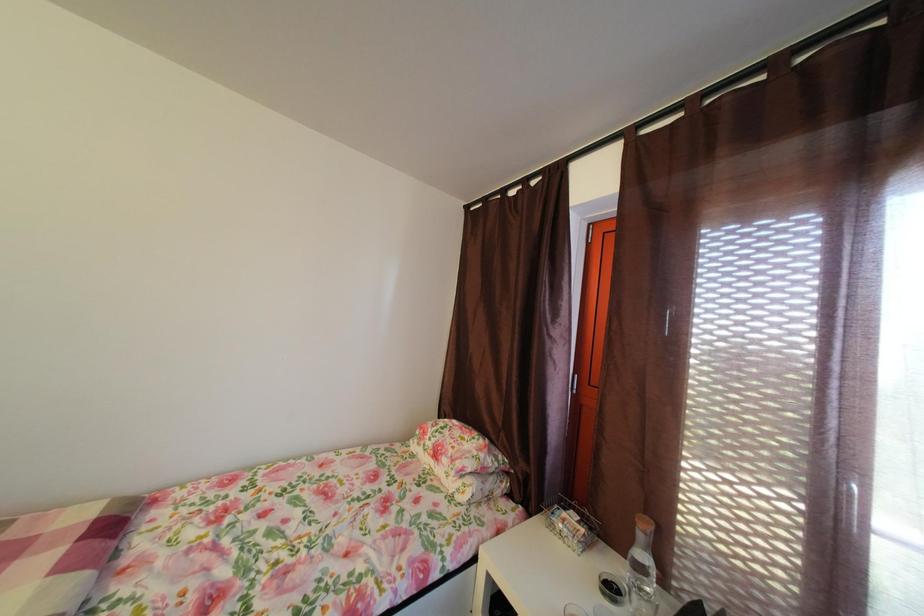
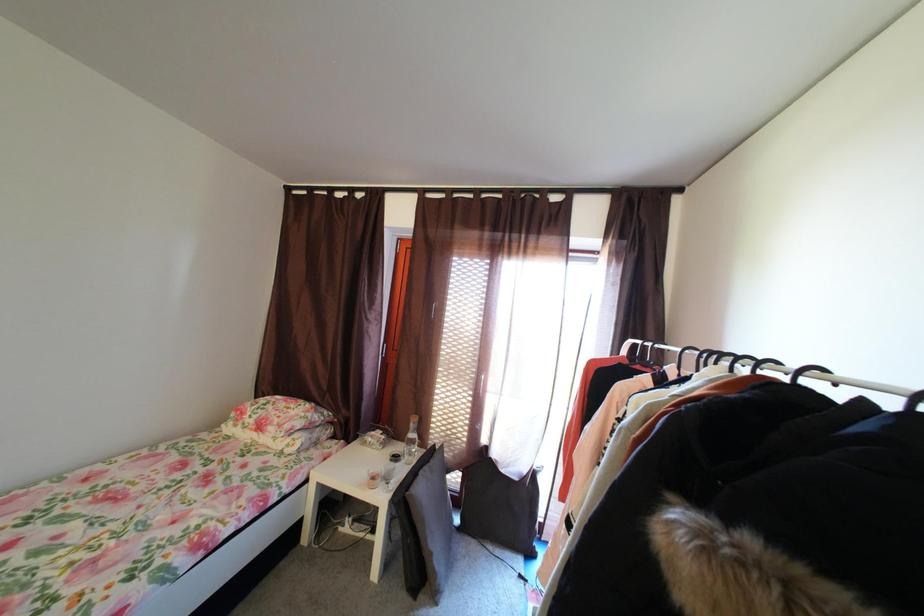
Question: The images are taken continuously from a first-person perspective. In which direction is your viewpoint rotating?

Choices:
 (A) Left
 (B) Right
 (C) Up
 (D) Down

Answer: (B)